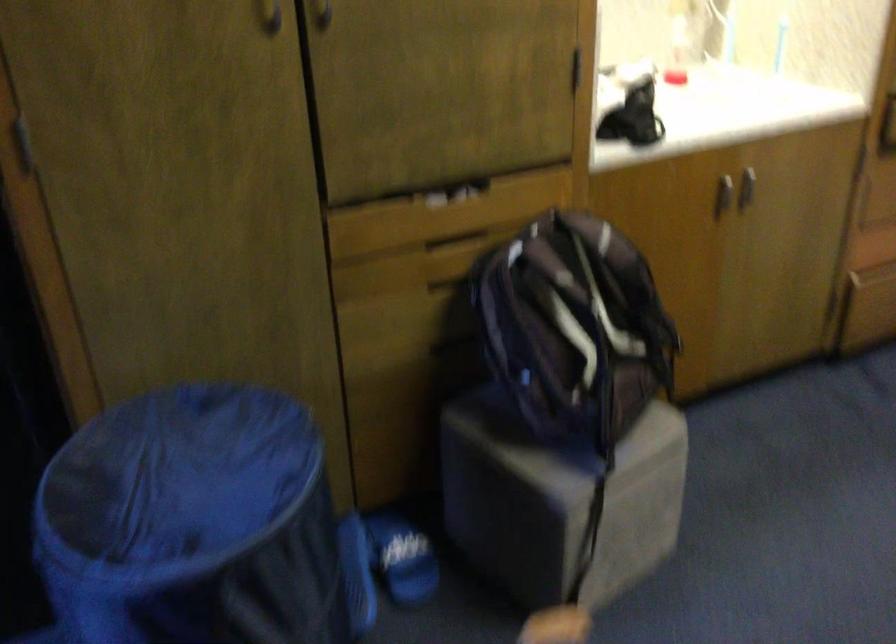
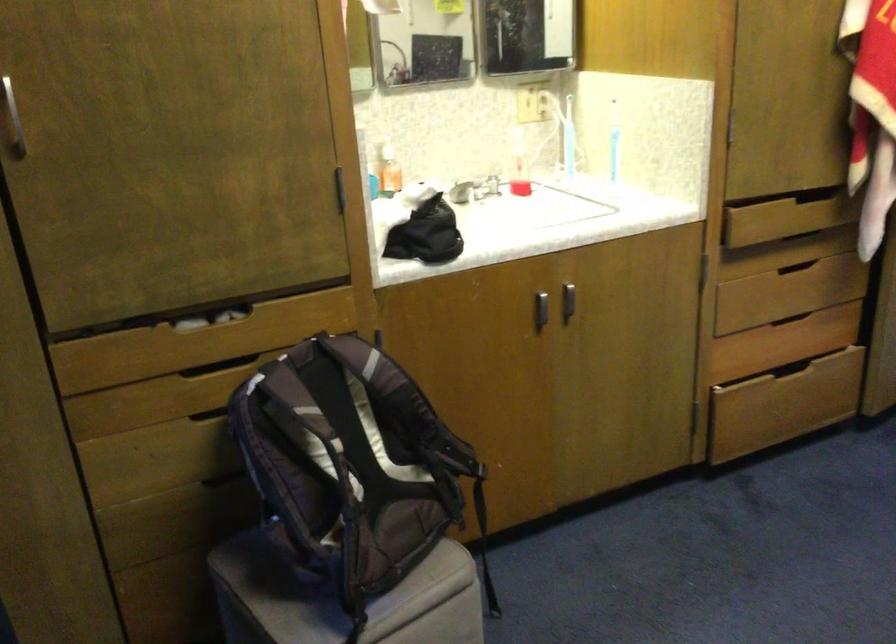
Question: In a continuous first-person perspective shot, in which direction is the camera moving?

Choices:
 (A) Left
 (B) Right
 (C) Forward
 (D) Backward

Answer: (B)